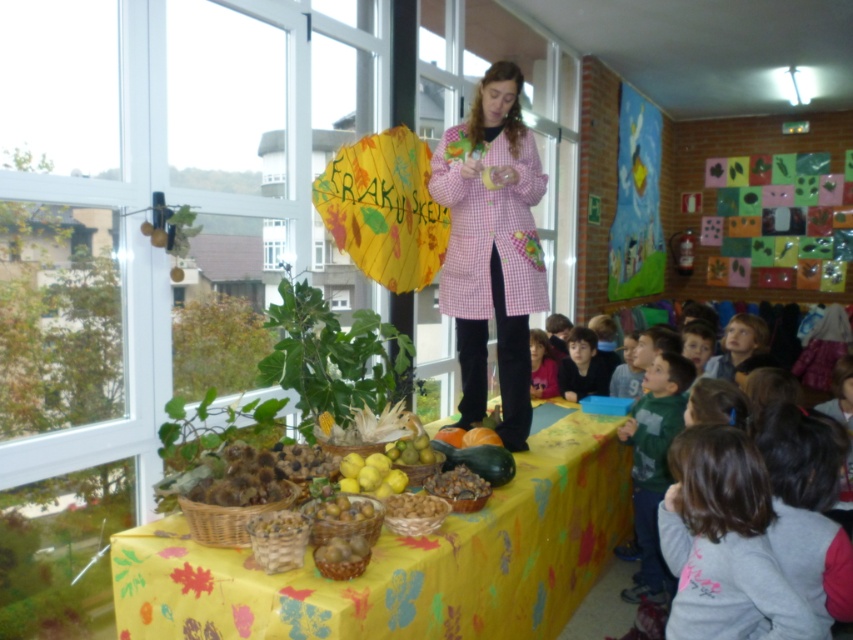
In the scene shown: Is brown hair at upper right shorter than brown hair at lower right?

Yes.

Who is more forward, [724,378] or [540,360]?

Positioned in front is point [724,378].

Where is `brown hair at upper right`? This screenshot has width=853, height=640. brown hair at upper right is located at coordinates coord(740,348).

The width and height of the screenshot is (853, 640). Describe the element at coordinates (653, 465) in the screenshot. I see `green cotton shirt at lower right` at that location.

Locate an element on the screen. green cotton shirt at lower right is located at coordinates (653, 465).

Does yellow fabric table at center have a smaller size compared to smooth brown hair at lower center?

Incorrect, yellow fabric table at center is not smaller in size than smooth brown hair at lower center.

Can you confirm if yellow fabric table at center is bigger than smooth brown hair at lower center?

Yes, yellow fabric table at center is bigger than smooth brown hair at lower center.

Find the location of a particular element. yellow fabric table at center is located at coordinates (405, 561).

Where is `yellow fabric table at center`? yellow fabric table at center is located at coordinates (405, 561).